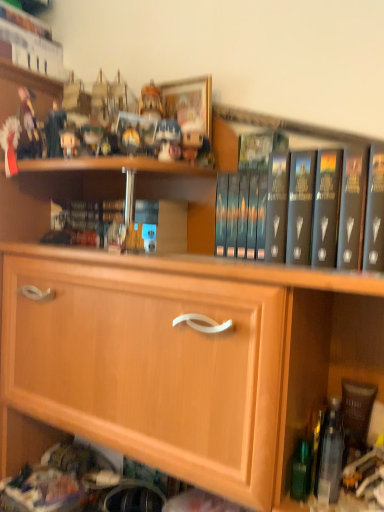
Question: In terms of size, does hardcover book at center, the third book from the top, appear bigger or smaller than wooden cabinet at center?

Choices:
 (A) big
 (B) small

Answer: (B)

Question: Is hardcover book at center, the third book from the top, wider or thinner than wooden cabinet at center?

Choices:
 (A) wide
 (B) thin

Answer: (B)

Question: Which is farther from the matte plastic figurine at upper left, marked as the second toy in a right-to-left arrangement?

Choices:
 (A) dark gray hardcover book at center, the 3th book in the left-to-right sequence
 (B) matte plastic toy at upper center, which appears as the first toy when viewed from the right
 (C) hardcover book at upper left, arranged as the 1th book when viewed from the left
 (D) hardcover book at center, which ranks as the first book in bottom-to-top order
 (E) wooden cabinet at center

Answer: (A)

Question: Which of these objects is positioned farthest from the hardcover book at upper left, the 1th book viewed from the back?

Choices:
 (A) wooden cabinet at center
 (B) hardcover book at center, the 2th book viewed from the front
 (C) dark gray hardcover book at center, the second book from the top
 (D) matte plastic figurine at upper left, placed as the first toy when sorted from left to right
 (E) clear plastic bottle at lower right

Answer: (E)